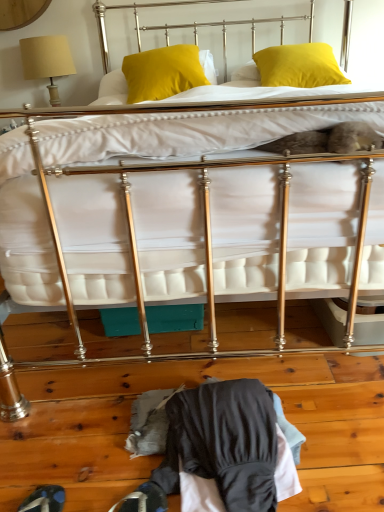
Question: From a real-world perspective, does dark gray fabric at lower center stand above yellow matte pillow at upper right, the second pillow viewed from the left?

Choices:
 (A) no
 (B) yes

Answer: (A)

Question: Can you confirm if dark gray fabric at lower center is smaller than yellow matte pillow at upper right, the second pillow viewed from the left?

Choices:
 (A) no
 (B) yes

Answer: (B)

Question: Can you see dark gray fabric at lower center touching yellow matte pillow at upper right, the second pillow viewed from the left?

Choices:
 (A) yes
 (B) no

Answer: (B)

Question: Considering the relative sizes of dark gray fabric at lower center and yellow matte pillow at upper right, the second pillow viewed from the left, in the image provided, is dark gray fabric at lower center wider than yellow matte pillow at upper right, the second pillow viewed from the left,?

Choices:
 (A) yes
 (B) no

Answer: (B)

Question: From the image's perspective, is dark gray fabric at lower center on top of yellow matte pillow at upper right, the second pillow viewed from the left?

Choices:
 (A) no
 (B) yes

Answer: (A)

Question: From a real-world perspective, is yellow matte pillow at upper right, placed as the 1th pillow when sorted from right to left, above or below dark blue leather shoe at lower left?

Choices:
 (A) above
 (B) below

Answer: (A)

Question: In terms of width, does yellow matte pillow at upper right, the second pillow viewed from the left, look wider or thinner when compared to dark blue leather shoe at lower left?

Choices:
 (A) wide
 (B) thin

Answer: (A)

Question: Is point (266, 76) positioned closer to the camera than point (36, 493)?

Choices:
 (A) farther
 (B) closer

Answer: (A)

Question: Would you say yellow matte pillow at upper right, placed as the 1th pillow when sorted from right to left, is to the left or to the right of dark blue leather shoe at lower left in the picture?

Choices:
 (A) right
 (B) left

Answer: (A)

Question: In the image, is yellow matte pillow at upper right, placed as the 1th pillow when sorted from right to left, on the left side or the right side of dark gray fabric at lower center?

Choices:
 (A) left
 (B) right

Answer: (B)

Question: Which is correct: yellow matte pillow at upper right, the second pillow viewed from the left, is inside dark gray fabric at lower center, or outside of it?

Choices:
 (A) inside
 (B) outside

Answer: (B)

Question: Is yellow matte pillow at upper right, the second pillow viewed from the left, in front of or behind dark gray fabric at lower center in the image?

Choices:
 (A) behind
 (B) front

Answer: (A)

Question: From a real-world perspective, relative to dark gray fabric at lower center, is yellow matte pillow at upper right, the second pillow viewed from the left, vertically above or below?

Choices:
 (A) above
 (B) below

Answer: (A)

Question: From a real-world perspective, is yellow velvet pillow at upper center, the 1th pillow in the left-to-right sequence, positioned above or below beige fabric lampshade at upper left?

Choices:
 (A) above
 (B) below

Answer: (A)

Question: Considering the positions of yellow velvet pillow at upper center, placed as the 2th pillow when sorted from right to left, and beige fabric lampshade at upper left in the image, is yellow velvet pillow at upper center, placed as the 2th pillow when sorted from right to left, wider or thinner than beige fabric lampshade at upper left?

Choices:
 (A) wide
 (B) thin

Answer: (A)